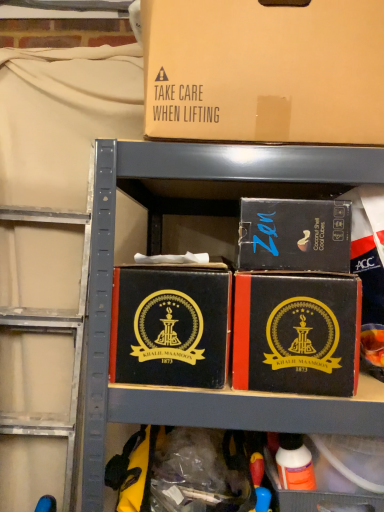
Question: Are black cardboard box at center, which appears as the first box when ordered from the bottom, and black cardboard box at center, acting as the 2th box starting from the top, located far from each other?

Choices:
 (A) yes
 (B) no

Answer: (B)

Question: Is black cardboard box at center, the fourth box in the top-to-bottom sequence, looking in the opposite direction of black cardboard box at center, acting as the 2th box starting from the top?

Choices:
 (A) yes
 (B) no

Answer: (B)

Question: Is black cardboard box at center, which appears as the first box when ordered from the bottom, further to camera compared to black cardboard box at center, acting as the 2th box starting from the top?

Choices:
 (A) yes
 (B) no

Answer: (B)

Question: From a real-world perspective, is black cardboard box at center, which appears as the first box when ordered from the bottom, physically below black cardboard box at center, acting as the 2th box starting from the top?

Choices:
 (A) no
 (B) yes

Answer: (B)

Question: Considering the relative positions of black cardboard box at center, the fourth box in the top-to-bottom sequence, and black cardboard box at center, placed as the 3th box when sorted from bottom to top, in the image provided, is black cardboard box at center, the fourth box in the top-to-bottom sequence, in front of black cardboard box at center, placed as the 3th box when sorted from bottom to top,?

Choices:
 (A) yes
 (B) no

Answer: (A)

Question: Is black cardboard box at center, which appears as the first box when ordered from the bottom, spatially inside brown cardboard box at upper center, the 4th box ordered from the bottom, or outside of it?

Choices:
 (A) inside
 (B) outside

Answer: (B)

Question: Would you say black cardboard box at center, the fourth box in the top-to-bottom sequence, is to the left or to the right of brown cardboard box at upper center, marked as the first box in a top-to-bottom arrangement, in the picture?

Choices:
 (A) right
 (B) left

Answer: (A)

Question: From the image's perspective, is black cardboard box at center, which appears as the first box when ordered from the bottom, positioned above or below brown cardboard box at upper center, marked as the first box in a top-to-bottom arrangement?

Choices:
 (A) above
 (B) below

Answer: (B)

Question: From a real-world perspective, is black cardboard box at center, which appears as the first box when ordered from the bottom, physically located above or below brown cardboard box at upper center, the 4th box ordered from the bottom?

Choices:
 (A) above
 (B) below

Answer: (B)

Question: In terms of width, does black leather box at center, the third box viewed from the top, look wider or thinner when compared to black cardboard box at center, acting as the 2th box starting from the top?

Choices:
 (A) thin
 (B) wide

Answer: (B)

Question: Does point (125, 343) appear closer or farther from the camera than point (302, 234)?

Choices:
 (A) farther
 (B) closer

Answer: (A)

Question: From the image's perspective, is black leather box at center, the third box viewed from the top, positioned above or below black cardboard box at center, acting as the 2th box starting from the top?

Choices:
 (A) below
 (B) above

Answer: (A)

Question: Considering the relative positions of black leather box at center, which ranks as the 2th box in bottom-to-top order, and black cardboard box at center, acting as the 2th box starting from the top, in the image provided, is black leather box at center, which ranks as the 2th box in bottom-to-top order, to the left or to the right of black cardboard box at center, acting as the 2th box starting from the top,?

Choices:
 (A) right
 (B) left

Answer: (B)

Question: Looking at their shapes, would you say black cardboard box at center, which appears as the first box when ordered from the bottom, is wider or thinner than orange matte bottle at lower right?

Choices:
 (A) wide
 (B) thin

Answer: (A)

Question: Based on their positions, is black cardboard box at center, which appears as the first box when ordered from the bottom, located to the left or right of orange matte bottle at lower right?

Choices:
 (A) right
 (B) left

Answer: (B)